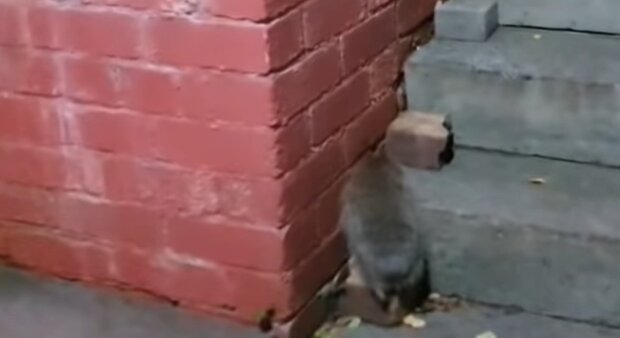
What are the coordinates of `wall` in the screenshot? It's located at (108, 196).